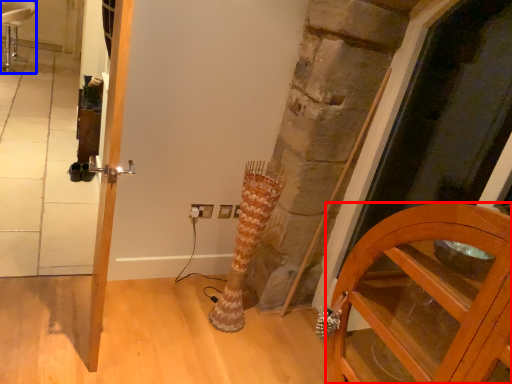
Question: Which object appears farthest to the camera in this image, cabinetry (highlighted by a red box) or chair (highlighted by a blue box)?

Choices:
 (A) cabinetry
 (B) chair

Answer: (B)